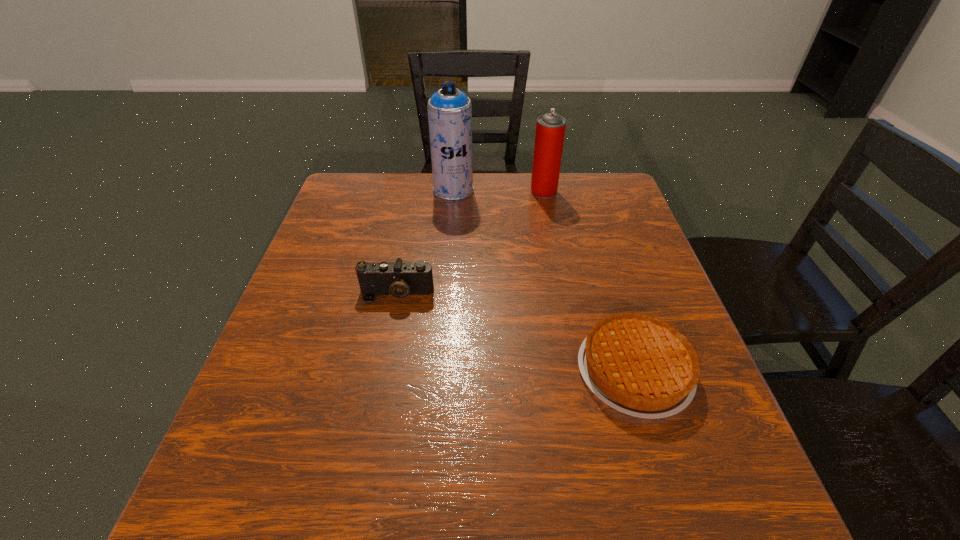
Locate an element on the screen. The width and height of the screenshot is (960, 540). the taller aerosol can is located at coordinates (449, 110).

Where is `the tallest object`? This screenshot has height=540, width=960. the tallest object is located at coordinates (449, 110).

This screenshot has height=540, width=960. I want to click on the third shortest object, so click(x=550, y=128).

Identify the location of the right aerosol can. Image resolution: width=960 pixels, height=540 pixels. (550, 128).

At what (x,y) coordinates should I click in order to perform the action: click on the second nearest object. Please return your answer as a coordinate pair (x, y). This screenshot has height=540, width=960. Looking at the image, I should click on (x=398, y=279).

Identify the location of the second shortest object. The width and height of the screenshot is (960, 540). (398, 279).

The height and width of the screenshot is (540, 960). I want to click on the nearest object, so click(x=639, y=365).

Locate an element on the screen. The width and height of the screenshot is (960, 540). pie is located at coordinates (639, 365).

Identify the location of vacant space located 0.210m on the front of the tallest object. (448, 247).

You are a GUI agent. You are given a task and a screenshot of the screen. Output one action in this format:
    pyautogui.click(x=<x>, y=<y>)
    Task: Click on the blank area located 0.090m on the right of the third shortest object
    The width and height of the screenshot is (960, 540).
    Given the screenshot: What is the action you would take?
    pyautogui.click(x=588, y=191)